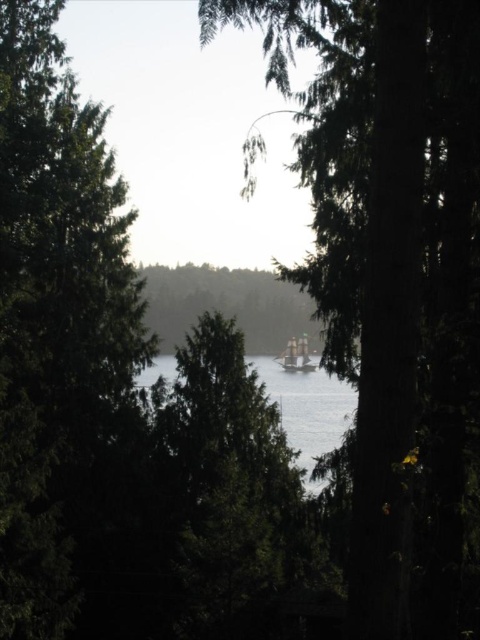
Question: Which point is closer to the camera?

Choices:
 (A) (309, 364)
 (B) (217, 4)
 (C) (348, 401)
 (D) (16, 461)

Answer: (B)

Question: Can you confirm if green textured tree at center is bigger than wooden ship at center?

Choices:
 (A) no
 (B) yes

Answer: (B)

Question: Observing the image, what is the correct spatial positioning of green textured tree at center in reference to green matte tree at center?

Choices:
 (A) right
 (B) left

Answer: (A)

Question: Which object is closer to the camera taking this photo?

Choices:
 (A) green textured tree at center
 (B) transparent water at center
 (C) wooden ship at center

Answer: (A)

Question: Which of the following is the closest to the observer?

Choices:
 (A) wooden ship at center
 (B) transparent water at center

Answer: (B)

Question: Is green matte tree at center behind wooden ship at center?

Choices:
 (A) yes
 (B) no

Answer: (B)